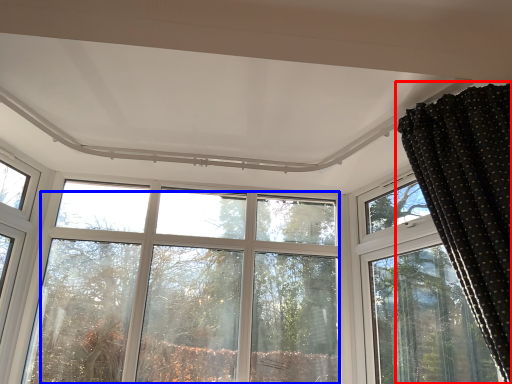
Question: Which object appears farthest to the camera in this image, curtain (highlighted by a red box) or tree (highlighted by a blue box)?

Choices:
 (A) curtain
 (B) tree

Answer: (B)